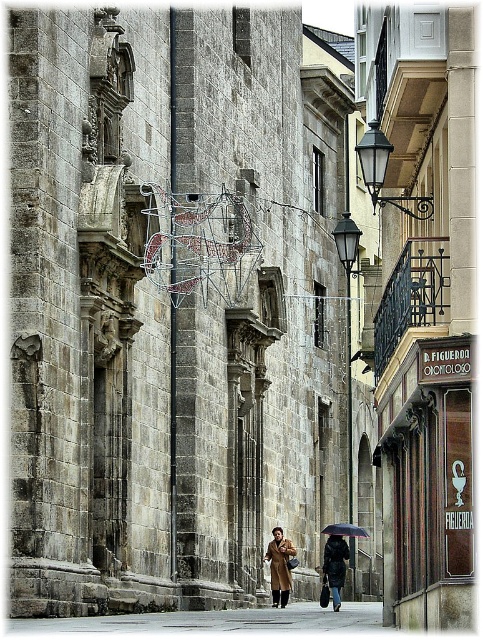
Is brown leather coat at center below dark brown leather coat at center?

Actually, brown leather coat at center is above dark brown leather coat at center.

Does brown leather coat at center appear on the right side of dark brown leather coat at center?

In fact, brown leather coat at center is to the left of dark brown leather coat at center.

Does point (266, 554) come in front of point (328, 554)?

Yes.

What are the coordinates of `brown leather coat at center` in the screenshot? It's located at (281, 566).

Does brown leather coat at center come in front of black matte umbrella at center?

Yes, it is.

This screenshot has height=640, width=483. I want to click on brown leather coat at center, so click(x=281, y=566).

Between gray concrete pavement at center and dark brown leather coat at center, which one appears on the right side from the viewer's perspective?

Positioned to the right is dark brown leather coat at center.

In the scene shown: Does gray concrete pavement at center have a lesser height compared to dark brown leather coat at center?

No.

Does point (237, 616) come closer to viewer compared to point (339, 568)?

That is True.

I want to click on gray concrete pavement at center, so click(x=217, y=620).